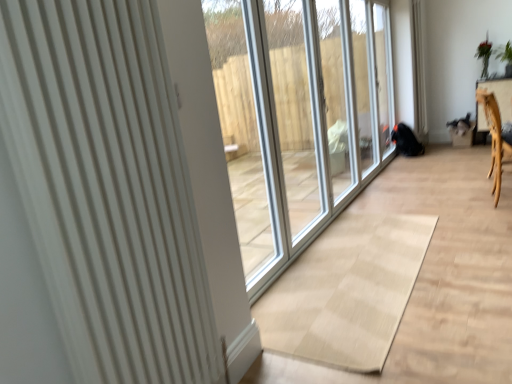
Question: Can you confirm if white ribbed radiator at left is bigger than wooden armchair at right?

Choices:
 (A) no
 (B) yes

Answer: (A)

Question: Considering the relative sizes of white ribbed radiator at left and wooden armchair at right in the image provided, is white ribbed radiator at left smaller than wooden armchair at right?

Choices:
 (A) no
 (B) yes

Answer: (B)

Question: From a real-world perspective, does white ribbed radiator at left stand above wooden armchair at right?

Choices:
 (A) no
 (B) yes

Answer: (B)

Question: Is white ribbed radiator at left to the left of wooden armchair at right from the viewer's perspective?

Choices:
 (A) yes
 (B) no

Answer: (A)

Question: Is white ribbed radiator at left completely or partially outside of wooden armchair at right?

Choices:
 (A) yes
 (B) no

Answer: (A)

Question: Can you see white ribbed radiator at left touching wooden armchair at right?

Choices:
 (A) yes
 (B) no

Answer: (B)

Question: Are wooden armchair at right and white ribbed radiator at left located far from each other?

Choices:
 (A) yes
 (B) no

Answer: (A)

Question: Does wooden armchair at right have a lesser height compared to white ribbed radiator at left?

Choices:
 (A) no
 (B) yes

Answer: (B)

Question: Does wooden armchair at right have a larger size compared to white ribbed radiator at left?

Choices:
 (A) no
 (B) yes

Answer: (B)

Question: Is wooden armchair at right positioned behind white ribbed radiator at left?

Choices:
 (A) yes
 (B) no

Answer: (A)

Question: Considering the relative sizes of wooden armchair at right and white ribbed radiator at left in the image provided, is wooden armchair at right thinner than white ribbed radiator at left?

Choices:
 (A) no
 (B) yes

Answer: (A)

Question: Is wooden armchair at right oriented away from white ribbed radiator at left?

Choices:
 (A) no
 (B) yes

Answer: (A)

Question: Relative to white ribbed radiator at left, is wooden armchair at right in front or behind?

Choices:
 (A) behind
 (B) front

Answer: (A)